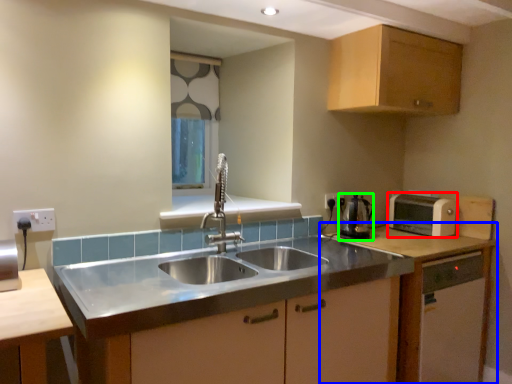
Question: Estimate the real-world distances between objects in this image. Which object is farther from toaster (highlighted by a red box), cabinetry (highlighted by a blue box) or appliance (highlighted by a green box)?

Choices:
 (A) cabinetry
 (B) appliance

Answer: (B)